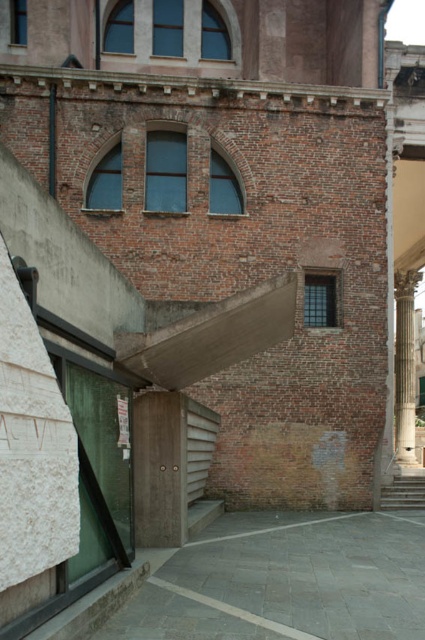
Question: Does white marble column at right have a smaller size compared to wooden stairs at lower right?

Choices:
 (A) no
 (B) yes

Answer: (A)

Question: Which object appears closest to the camera in this image?

Choices:
 (A) white marble column at right
 (B) wooden stairs at lower right

Answer: (B)

Question: Does white marble column at right lie in front of wooden stairs at lower right?

Choices:
 (A) no
 (B) yes

Answer: (A)

Question: Is the position of white marble column at right less distant than that of wooden stairs at lower right?

Choices:
 (A) yes
 (B) no

Answer: (B)

Question: Which of the following is the farthest from the observer?

Choices:
 (A) white marble column at right
 (B) wooden stairs at lower right

Answer: (A)